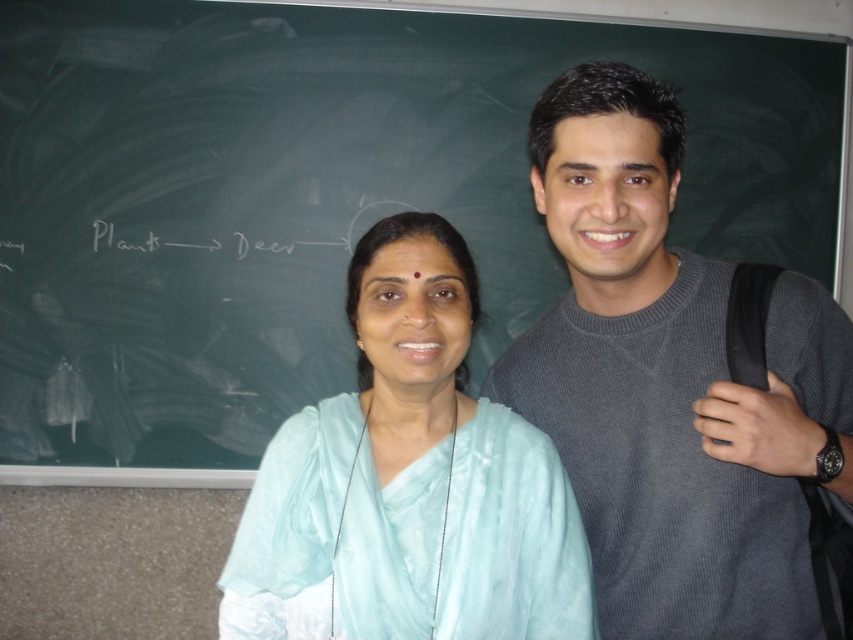
Question: Among these points, which one is nearest to the camera?

Choices:
 (A) (334, 413)
 (B) (606, 493)

Answer: (A)

Question: Considering the relative positions of gray sweater at center and light blue silk saree at center in the image provided, where is gray sweater at center located with respect to light blue silk saree at center?

Choices:
 (A) below
 (B) above

Answer: (B)

Question: Can you confirm if gray sweater at center is thinner than light blue silk saree at center?

Choices:
 (A) no
 (B) yes

Answer: (B)

Question: Does gray sweater at center have a lesser width compared to light blue silk saree at center?

Choices:
 (A) no
 (B) yes

Answer: (B)